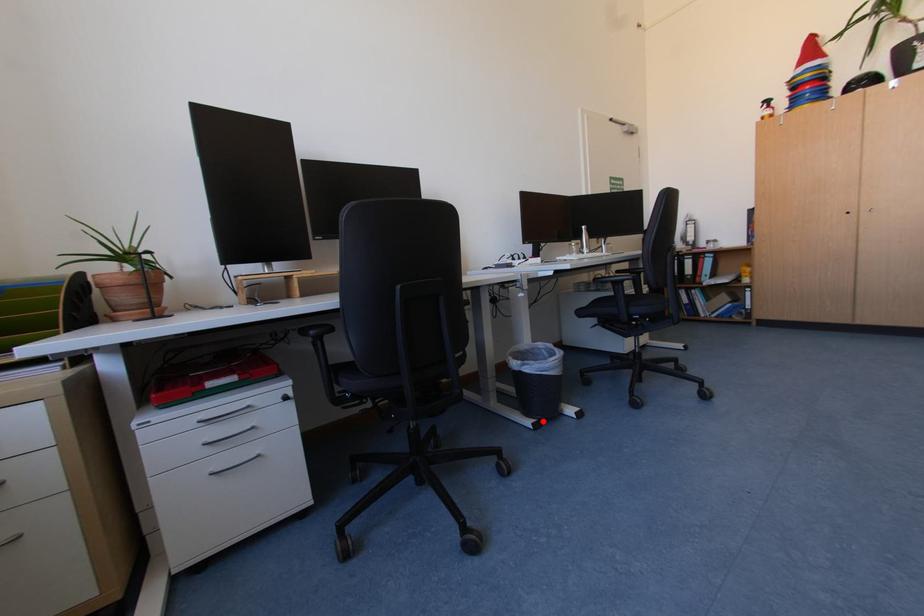
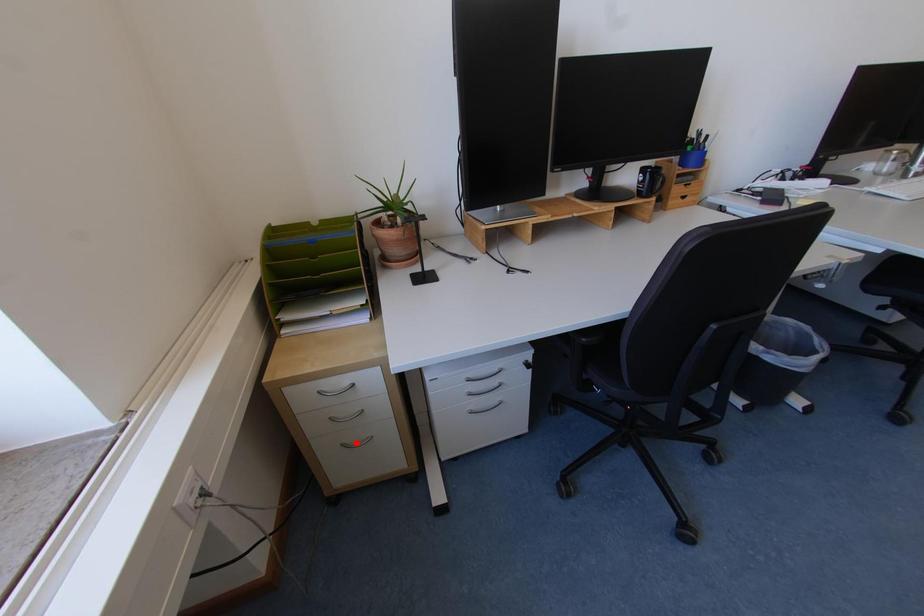
I am providing you with two images of the same scene from different viewpoints. A red point is marked on the first image and another point is marked on the second image. Does the point marked in image1 correspond to the same location as the one in image2?

No